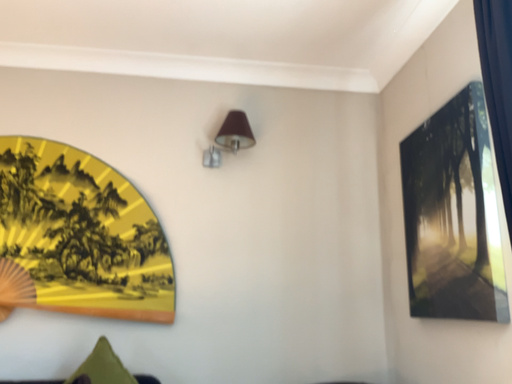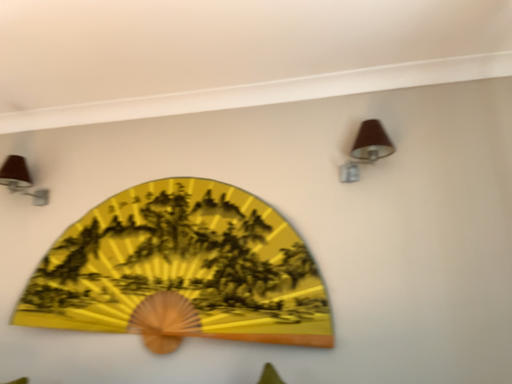
Question: How did the camera likely rotate when shooting the video?

Choices:
 (A) rotated right
 (B) rotated left

Answer: (B)